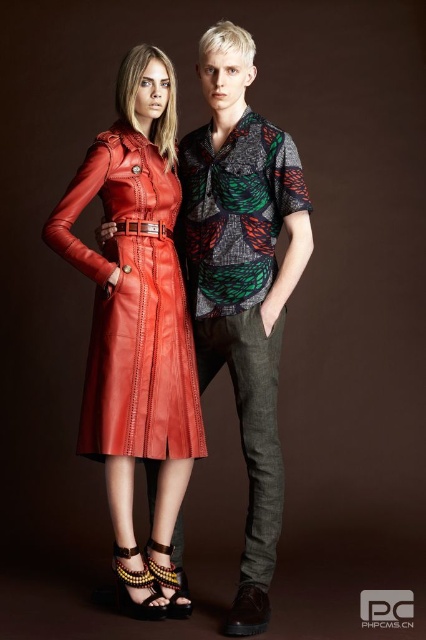
Question: Which object appears farthest from the camera in this image?

Choices:
 (A) matte leather dress at center
 (B) gold metallic sandal at lower center
 (C) multicolored beaded sandal at lower center
 (D) matte leather dress at left

Answer: (B)

Question: Is matte leather dress at left to the right of gold metallic sandal at lower center from the viewer's perspective?

Choices:
 (A) yes
 (B) no

Answer: (B)

Question: Among these points, which one is nearest to the camera?

Choices:
 (A) (81, 180)
 (B) (146, 568)
 (C) (149, 72)
 (D) (149, 544)

Answer: (A)

Question: From the image, what is the correct spatial relationship of matte leather dress at left in relation to multicolored beaded sandal at lower center?

Choices:
 (A) above
 (B) below

Answer: (A)

Question: Which object appears closest to the camera in this image?

Choices:
 (A) gold metallic sandal at lower center
 (B) matte leather dress at left

Answer: (B)

Question: Can you confirm if matte leather dress at left is thinner than multicolored beaded sandal at lower center?

Choices:
 (A) no
 (B) yes

Answer: (A)